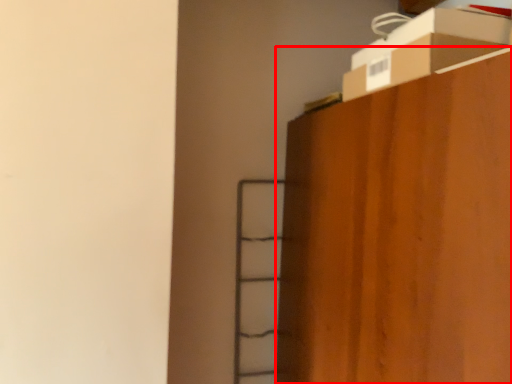
Question: Considering the relative positions of furniture (annotated by the red box) and cardboard box in the image provided, where is furniture (annotated by the red box) located with respect to the staircase?

Choices:
 (A) right
 (B) left

Answer: (A)